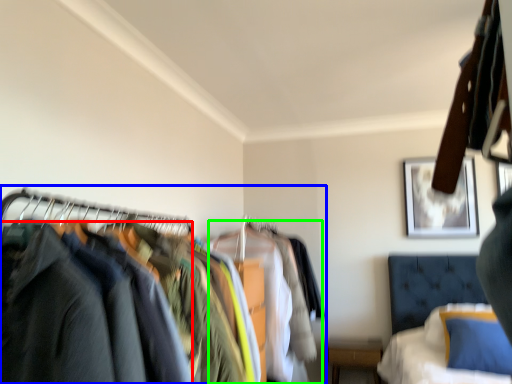
Question: Which is nearer to the clothing (highlighted by a red box)? closet (highlighted by a blue box) or clothing (highlighted by a green box).

Choices:
 (A) closet
 (B) clothing

Answer: (A)